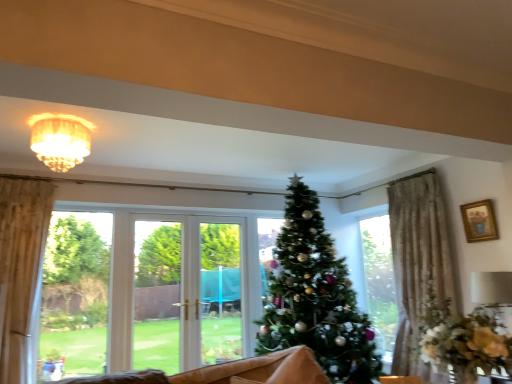
What do you see at coordinates (316, 297) in the screenshot?
I see `green matte christmas tree at center` at bounding box center [316, 297].

You are a GUI agent. You are given a task and a screenshot of the screen. Output one action in this format:
    pyautogui.click(x=<x>, y=<y>)
    Task: Click on the gold-framed picture at upper right
    
    Given the screenshot: What is the action you would take?
    pyautogui.click(x=479, y=221)

What do you see at coordinates (400, 380) in the screenshot? Image resolution: width=512 pixels, height=384 pixels. I see `wooden coffee table at lower center` at bounding box center [400, 380].

Locate an element on the screen. The width and height of the screenshot is (512, 384). matte gold chandelier at upper center is located at coordinates click(60, 139).

Is green matte christmas tree at center spatially inside gold-framed picture at upper right, or outside of it?

green matte christmas tree at center is not enclosed by gold-framed picture at upper right.

From a real-world perspective, is green matte christmas tree at center positioned above or below gold-framed picture at upper right?

Clearly, from a real-world perspective, green matte christmas tree at center is below gold-framed picture at upper right.

What's the angular difference between green matte christmas tree at center and gold-framed picture at upper right's facing directions?

The facing directions of green matte christmas tree at center and gold-framed picture at upper right are 90 degrees apart.

Is green matte christmas tree at center taller or shorter than gold-framed picture at upper right?

Considering their sizes, green matte christmas tree at center has more height than gold-framed picture at upper right.

Based on their sizes in the image, would you say matte gold chandelier at upper center is bigger or smaller than gold-framed picture at upper right?

Clearly, matte gold chandelier at upper center is larger in size than gold-framed picture at upper right.

Is matte gold chandelier at upper center in front of or behind gold-framed picture at upper right in the image?

matte gold chandelier at upper center is positioned closer to the viewer than gold-framed picture at upper right.

Based on their positions, is matte gold chandelier at upper center located to the left or right of gold-framed picture at upper right?

From the image, it's evident that matte gold chandelier at upper center is to the left of gold-framed picture at upper right.

Considering the relative sizes of wooden coffee table at lower center and matte gold chandelier at upper center in the image provided, is wooden coffee table at lower center thinner than matte gold chandelier at upper center?

Correct, the width of wooden coffee table at lower center is less than that of matte gold chandelier at upper center.

Is point (405, 382) positioned behind point (77, 136)?

No.

Considering the positions of objects wooden coffee table at lower center and matte gold chandelier at upper center in the image provided, who is more to the left, wooden coffee table at lower center or matte gold chandelier at upper center?

Positioned to the left is matte gold chandelier at upper center.

Measure the distance from wooden coffee table at lower center to matte gold chandelier at upper center.

8.70 feet.

Find the location of a particular element. This screenshot has height=384, width=512. christmas tree lying behind the wooden coffee table at lower center is located at coordinates (316, 297).

Is wooden coffee table at lower center not close to green matte christmas tree at center?

Yes, wooden coffee table at lower center and green matte christmas tree at center are located far from each other.

Is wooden coffee table at lower center facing towards green matte christmas tree at center?

No, wooden coffee table at lower center is not oriented towards green matte christmas tree at center.

How many degrees apart are the facing directions of wooden coffee table at lower center and green matte christmas tree at center?

The angle between the facing direction of wooden coffee table at lower center and the facing direction of green matte christmas tree at center is 34.6 degrees.

You are a GUI agent. You are given a task and a screenshot of the screen. Output one action in this format:
    pyautogui.click(x=<x>, y=<y>)
    Task: Click on the furniture on the right of matte gold chandelier at upper center
    The height and width of the screenshot is (384, 512).
    Given the screenshot: What is the action you would take?
    click(400, 380)

Is matte gold chandelier at upper center outside of wooden coffee table at lower center?

Yes, matte gold chandelier at upper center is located beyond the bounds of wooden coffee table at lower center.

Between matte gold chandelier at upper center and wooden coffee table at lower center, which one has less height?

wooden coffee table at lower center is shorter.

What's the angular difference between matte gold chandelier at upper center and wooden coffee table at lower center's facing directions?

The facing directions of matte gold chandelier at upper center and wooden coffee table at lower center are 33.3 degrees apart.

How different are the orientations of gold-framed picture at upper right and matte gold chandelier at upper center in degrees?

They differ by 88.7 degrees in their facing directions.

Considering the sizes of gold-framed picture at upper right and matte gold chandelier at upper center in the image, is gold-framed picture at upper right taller or shorter than matte gold chandelier at upper center?

Clearly, gold-framed picture at upper right is shorter compared to matte gold chandelier at upper center.

You are a GUI agent. You are given a task and a screenshot of the screen. Output one action in this format:
    pyautogui.click(x=<x>, y=<y>)
    Task: Click on the light fixture located in front of the gold-framed picture at upper right
    This screenshot has height=384, width=512.
    Given the screenshot: What is the action you would take?
    pyautogui.click(x=60, y=139)

Considering the sizes of objects gold-framed picture at upper right and matte gold chandelier at upper center in the image provided, who is smaller, gold-framed picture at upper right or matte gold chandelier at upper center?

gold-framed picture at upper right is smaller.

Does green matte christmas tree at center have a greater width compared to wooden coffee table at lower center?

Yes.

Where is `christmas tree to the left of wooden coffee table at lower center`? This screenshot has height=384, width=512. christmas tree to the left of wooden coffee table at lower center is located at coordinates (316, 297).

Are green matte christmas tree at center and wooden coffee table at lower center located far from each other?

That's right, there is a large distance between green matte christmas tree at center and wooden coffee table at lower center.

Is the position of green matte christmas tree at center less distant than that of wooden coffee table at lower center?

No, it is behind wooden coffee table at lower center.

This screenshot has width=512, height=384. What are the coordinates of `picture frame to the right of green matte christmas tree at center` in the screenshot? It's located at (479, 221).

In order to click on light fixture above the gold-framed picture at upper right (from a real-world perspective) in this screenshot , I will do `click(60, 139)`.

Estimate the real-world distances between objects in this image. Which object is further from matte gold chandelier at upper center, green matte christmas tree at center or wooden coffee table at lower center?

Among the two, wooden coffee table at lower center is located further to matte gold chandelier at upper center.

From the image, which object appears to be nearer to matte gold chandelier at upper center, wooden coffee table at lower center or green matte christmas tree at center?

The object closer to matte gold chandelier at upper center is green matte christmas tree at center.

Considering their positions, is matte gold chandelier at upper center positioned further to green matte christmas tree at center than gold-framed picture at upper right?

matte gold chandelier at upper center lies further to green matte christmas tree at center than the other object.

When comparing their distances from gold-framed picture at upper right, does matte gold chandelier at upper center or wooden coffee table at lower center seem further?

Based on the image, matte gold chandelier at upper center appears to be further to gold-framed picture at upper right.

From the image, which object appears to be nearer to green matte christmas tree at center, gold-framed picture at upper right or matte gold chandelier at upper center?

gold-framed picture at upper right.

Considering their positions, is gold-framed picture at upper right positioned further to wooden coffee table at lower center than green matte christmas tree at center?

Among the two, gold-framed picture at upper right is located further to wooden coffee table at lower center.

In the scene shown: Based on their spatial positions, is matte gold chandelier at upper center or gold-framed picture at upper right closer to wooden coffee table at lower center?

The object closer to wooden coffee table at lower center is gold-framed picture at upper right.

When comparing their distances from matte gold chandelier at upper center, does green matte christmas tree at center or gold-framed picture at upper right seem further?

gold-framed picture at upper right.

Locate an element on the screen. This screenshot has height=384, width=512. christmas tree between matte gold chandelier at upper center and gold-framed picture at upper right is located at coordinates (316, 297).

The image size is (512, 384). Find the location of `furniture situated between matte gold chandelier at upper center and gold-framed picture at upper right from left to right`. furniture situated between matte gold chandelier at upper center and gold-framed picture at upper right from left to right is located at coordinates (400, 380).

This screenshot has height=384, width=512. Find the location of `christmas tree between matte gold chandelier at upper center and wooden coffee table at lower center in the horizontal direction`. christmas tree between matte gold chandelier at upper center and wooden coffee table at lower center in the horizontal direction is located at coordinates (316, 297).

The height and width of the screenshot is (384, 512). What are the coordinates of `christmas tree between wooden coffee table at lower center and gold-framed picture at upper right in the front-back direction` in the screenshot? It's located at (316, 297).